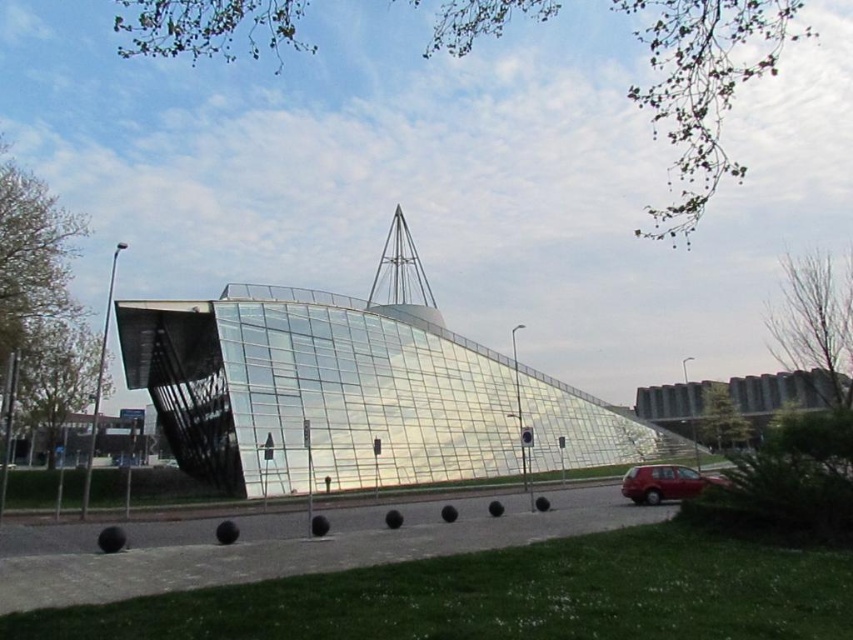
You are standing in front of the transparent glass building at center and want to walk to the transparent glass pyramid at center. Which direction should you move to get closer to the pyramid?

You should move forward since the transparent glass building at center is closer to you than the transparent glass pyramid at center, meaning the pyramid is further away and you need to move toward it by going forward.

You are a photographer planning to take a photo of the transparent glass building at center and the shiny red car at lower right. Considering their heights, which object should you focus on first to ensure both are in frame without needing to adjust the camera angle?

The transparent glass building at center is much taller than the shiny red car at lower right, so you should focus on the transparent glass building at center first to ensure both are in frame without needing to adjust the camera angle.

Looking at this image, you are standing at the entrance of the transparent glass building at center. You want to walk to the triangular metal element on top of the building. Which direction should you move relative to the building?

The triangular metal element is on top of the transparent glass building at center, so you should move upward relative to the building to reach it.